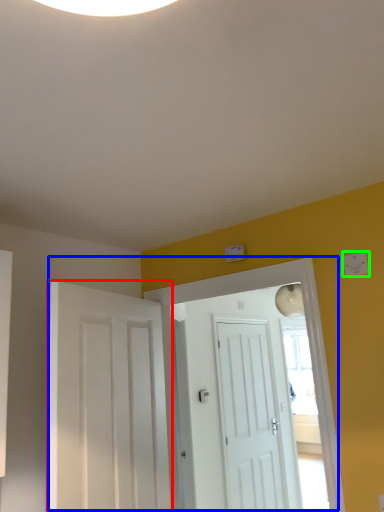
Question: Which object is the farthest from door (highlighted by a red box)? Choose among these: door (highlighted by a blue box) or light switch (highlighted by a green box).

Choices:
 (A) door
 (B) light switch

Answer: (B)